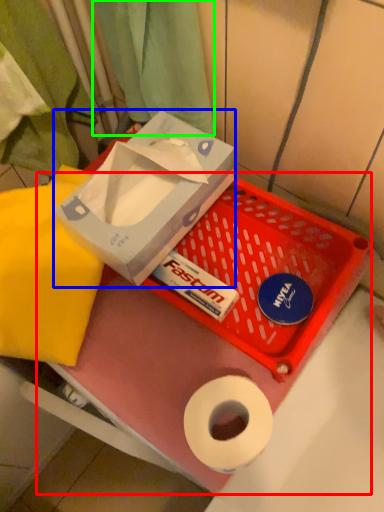
Question: Which object is positioned closest to box (highlighted by a red box)? Select from box (highlighted by a blue box) and curtain (highlighted by a green box).

Choices:
 (A) box
 (B) curtain

Answer: (A)